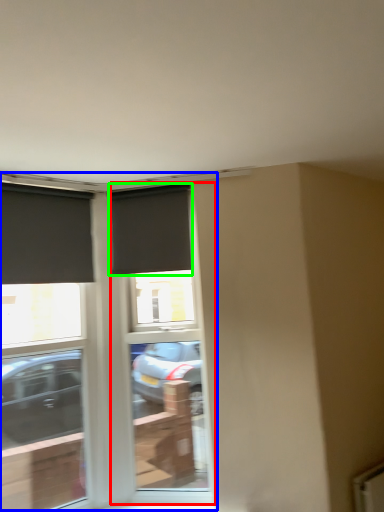
Question: Which is farther away from screen door (highlighted by a red box)? window (highlighted by a blue box) or window (highlighted by a green box)?

Choices:
 (A) window
 (B) window

Answer: (B)